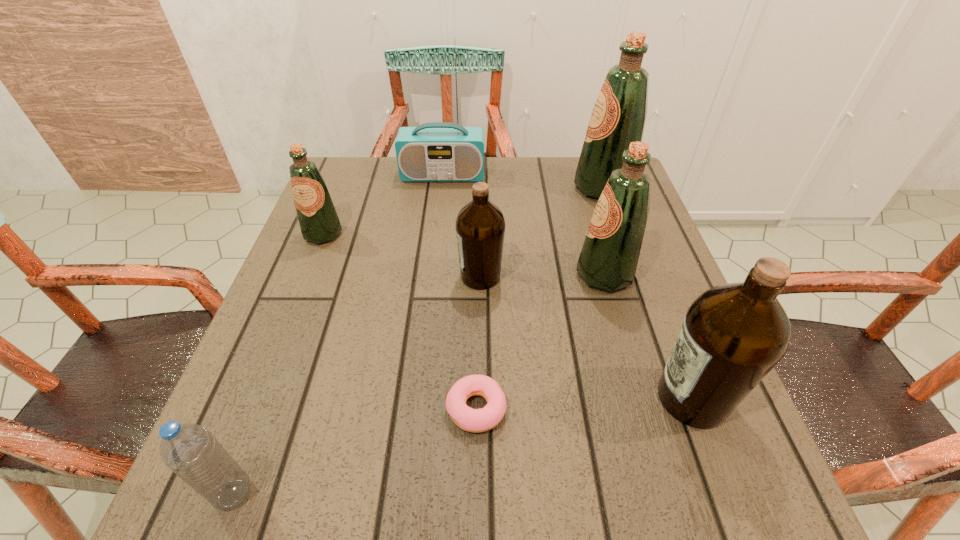
You are a GUI agent. You are given a task and a screenshot of the screen. Output one action in this format:
    pyautogui.click(x=<x>, y=<y>)
    Task: Click on the biggest green olive oil
    This screenshot has height=540, width=960.
    Given the screenshot: What is the action you would take?
    pyautogui.click(x=618, y=118)

Find the location of a particular element. the farthest green olive oil is located at coordinates [618, 118].

The height and width of the screenshot is (540, 960). I want to click on light radio receiver, so click(437, 151).

Where is `the second smallest green olive oil`? The image size is (960, 540). the second smallest green olive oil is located at coordinates (609, 257).

You are a GUI agent. You are given a task and a screenshot of the screen. Output one action in this format:
    pyautogui.click(x=<x>, y=<y>)
    Task: Click on the bigger brown olive oil
    The height and width of the screenshot is (540, 960).
    Given the screenshot: What is the action you would take?
    pyautogui.click(x=733, y=335)

Locate an element on the screen. the right brown olive oil is located at coordinates (733, 335).

Find the location of `the farther brown olive oil`. the farther brown olive oil is located at coordinates click(480, 225).

The image size is (960, 540). Identify the location of the fourth olive oil from right to left. (480, 225).

Where is `the smallest green olive oil`? The height and width of the screenshot is (540, 960). the smallest green olive oil is located at coordinates (319, 222).

I want to click on the leftmost olive oil, so click(x=319, y=222).